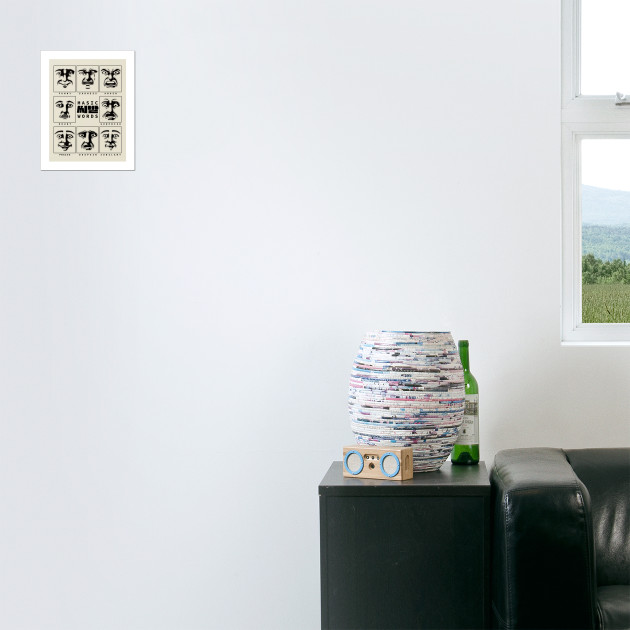
Where is `white background wall space`? This screenshot has width=630, height=630. white background wall space is located at coordinates (113, 505), (82, 312), (252, 365), (239, 76), (520, 91), (533, 369).